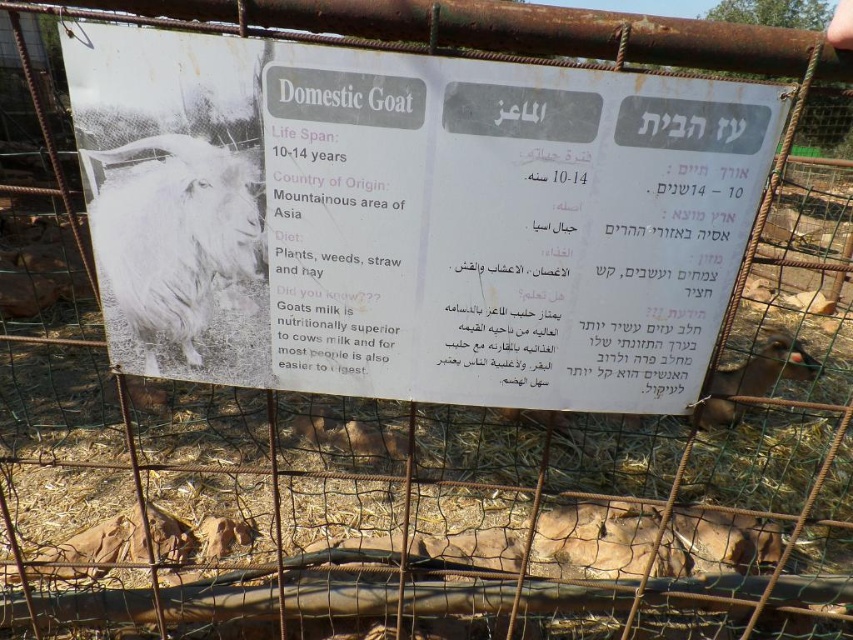
You are looking at a signboard about goats. There is a white fluffy goat at upper left and a brown furry goat at center. Which goat is more to the left?

The white fluffy goat at upper left is more to the left.

You are a zookeeper who wants to place a new informational sign about the white fluffy goat at upper left next to the existing white paper sign at center. Based on their sizes, which object should be placed lower to avoid blocking the other?

The white paper sign at center is much taller than the white fluffy goat at upper left, so to avoid blocking, the shorter white fluffy goat at upper left should be placed lower than the taller white paper sign at center.